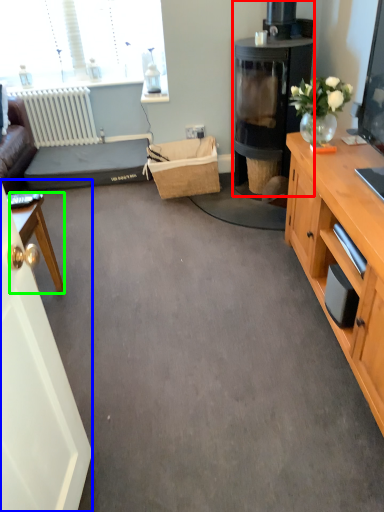
Question: Estimate the real-world distances between objects in this image. Which object is closer to fireplace (highlighted by a red box), glass door (highlighted by a blue box) or desk (highlighted by a green box)?

Choices:
 (A) glass door
 (B) desk

Answer: (B)